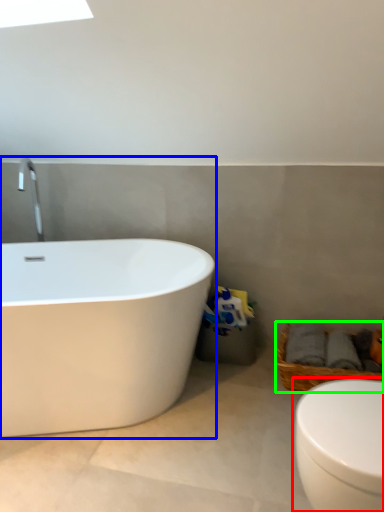
Question: Considering the real-world distances, which object is closest to toilet (highlighted by a red box)? bathtub (highlighted by a blue box) or basket (highlighted by a green box).

Choices:
 (A) bathtub
 (B) basket

Answer: (B)